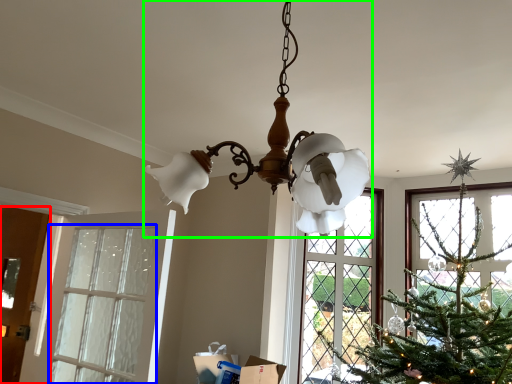
Question: Estimate the real-world distances between objects in this image. Which object is closer to door (highlighted by a red box), window (highlighted by a blue box) or lamp (highlighted by a green box)?

Choices:
 (A) window
 (B) lamp

Answer: (A)